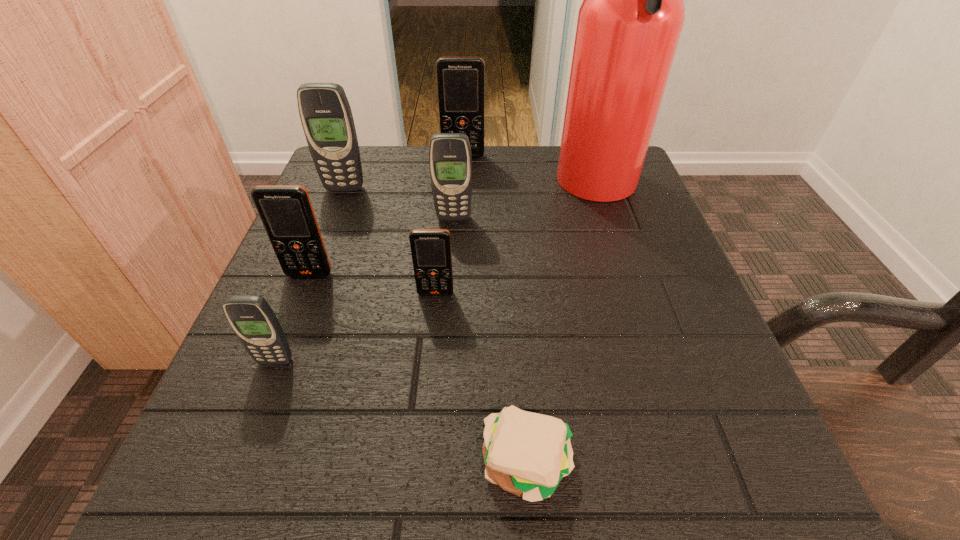
Locate an element on the screen. the sixth farthest object is located at coordinates (430, 248).

Find the location of a particular element. The height and width of the screenshot is (540, 960). the second nearest cellular telephone is located at coordinates (430, 248).

The image size is (960, 540). What are the coordinates of `the nearest cellular telephone` in the screenshot? It's located at (252, 319).

I want to click on the smallest gray cellular telephone, so click(252, 319).

The height and width of the screenshot is (540, 960). Identify the location of the nearest object. (527, 454).

This screenshot has width=960, height=540. I want to click on patty, so click(527, 454).

You are a GUI agent. You are given a task and a screenshot of the screen. Output one action in this format:
    pyautogui.click(x=<x>, y=<y>)
    Task: Click on the free space located 0.200m on the front of the tallest object
    The image size is (960, 540).
    Given the screenshot: What is the action you would take?
    pyautogui.click(x=636, y=307)

At what (x,y) coordinates should I click in order to perform the action: click on vacant position located 0.150m on the screen of the farthest orange cellular telephone. Please return your answer as a coordinate pair (x, y). The image size is (960, 540). Looking at the image, I should click on (462, 195).

The height and width of the screenshot is (540, 960). In order to click on free space located on the screen of the farthest gray cellular telephone in this screenshot , I will do `click(326, 237)`.

The height and width of the screenshot is (540, 960). I want to click on vacant space located 0.250m on the screen of the fourth nearest cellular telephone, so click(446, 319).